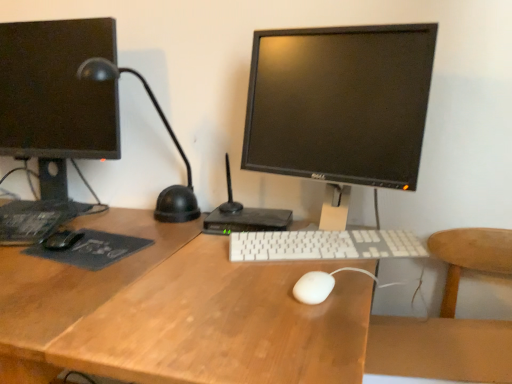
Image resolution: width=512 pixels, height=384 pixels. What are the coordinates of `free space to the left of white plastic keyboard at center` in the screenshot? It's located at (186, 259).